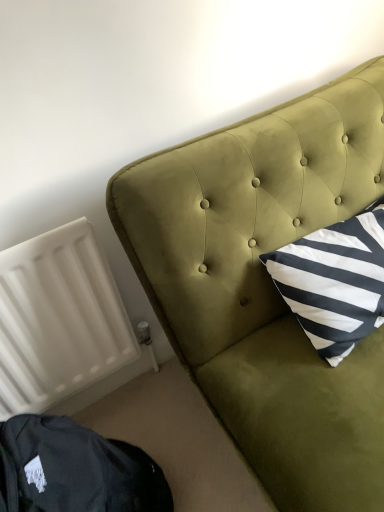
Measure the distance between dark green velvet bean bag chair at lower left and camera.

29.19 inches.

What are the coordinates of `velvet green headboard at upper right` in the screenshot? It's located at (267, 284).

Does velvet green headboard at upper right have a greater height compared to dark green velvet bean bag chair at lower left?

Yes, velvet green headboard at upper right is taller than dark green velvet bean bag chair at lower left.

Based on the photo, is velvet green headboard at upper right far from dark green velvet bean bag chair at lower left?

No.

Considering the relative sizes of velvet green headboard at upper right and dark green velvet bean bag chair at lower left in the image provided, is velvet green headboard at upper right thinner than dark green velvet bean bag chair at lower left?

Incorrect, the width of velvet green headboard at upper right is not less than that of dark green velvet bean bag chair at lower left.

Is velvet green headboard at upper right positioned with its back to dark green velvet bean bag chair at lower left?

velvet green headboard at upper right does not have its back to dark green velvet bean bag chair at lower left.

Considering the relative sizes of dark green velvet bean bag chair at lower left and white matte radiator at lower left in the image provided, is dark green velvet bean bag chair at lower left taller than white matte radiator at lower left?

No.

Between dark green velvet bean bag chair at lower left and white matte radiator at lower left, which one appears on the right side from the viewer's perspective?

dark green velvet bean bag chair at lower left is more to the right.

How many degrees apart are the facing directions of dark green velvet bean bag chair at lower left and white matte radiator at lower left?

The facing directions of dark green velvet bean bag chair at lower left and white matte radiator at lower left are 69.5 degrees apart.

In the image, is dark green velvet bean bag chair at lower left positioned in front of or behind velvet green headboard at upper right?

Visually, dark green velvet bean bag chair at lower left is located behind velvet green headboard at upper right.

Looking at this image, from the image's perspective, is dark green velvet bean bag chair at lower left positioned above or below velvet green headboard at upper right?

dark green velvet bean bag chair at lower left is below velvet green headboard at upper right.

Can you see dark green velvet bean bag chair at lower left touching velvet green headboard at upper right?

No, dark green velvet bean bag chair at lower left is not next to velvet green headboard at upper right.

Does point (74, 392) come in front of point (235, 270)?

No, (74, 392) is further to viewer.

From the image's perspective, is white matte radiator at lower left over velvet green headboard at upper right?

No, from the image's perspective, white matte radiator at lower left is not on top of velvet green headboard at upper right.

Which of these two, white matte radiator at lower left or velvet green headboard at upper right, is wider?

Wider between the two is velvet green headboard at upper right.

Which object is further away from the camera taking this photo, white matte radiator at lower left or velvet green headboard at upper right?

white matte radiator at lower left.

Can you confirm if white matte radiator at lower left is wider than dark green velvet bean bag chair at lower left?

No, white matte radiator at lower left is not wider than dark green velvet bean bag chair at lower left.

Is white matte radiator at lower left in contact with dark green velvet bean bag chair at lower left?

There is a gap between white matte radiator at lower left and dark green velvet bean bag chair at lower left.

Which point is more distant from viewer, (29, 411) or (116, 486)?

The point (29, 411) is more distant.

Measure the distance between white matte radiator at lower left and dark green velvet bean bag chair at lower left.

The distance of white matte radiator at lower left from dark green velvet bean bag chair at lower left is 10.85 inches.

Looking at this image, which object is wider, velvet green headboard at upper right or white matte radiator at lower left?

With larger width is velvet green headboard at upper right.

From the image's perspective, is velvet green headboard at upper right beneath white matte radiator at lower left?

No, from the image's perspective, velvet green headboard at upper right is not beneath white matte radiator at lower left.

Is point (336, 108) positioned behind point (81, 355)?

No.

Does velvet green headboard at upper right lie behind white matte radiator at lower left?

No, velvet green headboard at upper right is closer to the camera.

Locate an element on the screen. furniture on the right of dark green velvet bean bag chair at lower left is located at coordinates (267, 284).

Locate an element on the screen. bean bag chair that appears in front of the white matte radiator at lower left is located at coordinates (75, 470).

Estimate the real-world distances between objects in this image. Which object is closer to dark green velvet bean bag chair at lower left, velvet green headboard at upper right or white matte radiator at lower left?

white matte radiator at lower left.

Which object lies further to the anchor point white matte radiator at lower left, velvet green headboard at upper right or dark green velvet bean bag chair at lower left?

velvet green headboard at upper right lies further to white matte radiator at lower left than the other object.

Based on the photo, looking at the image, which one is located further to velvet green headboard at upper right, dark green velvet bean bag chair at lower left or white matte radiator at lower left?

dark green velvet bean bag chair at lower left lies further to velvet green headboard at upper right than the other object.

Considering their positions, is white matte radiator at lower left positioned closer to velvet green headboard at upper right than dark green velvet bean bag chair at lower left?

white matte radiator at lower left is closer to velvet green headboard at upper right.

Considering their positions, is white matte radiator at lower left positioned closer to dark green velvet bean bag chair at lower left than velvet green headboard at upper right?

white matte radiator at lower left is positioned closer to the anchor dark green velvet bean bag chair at lower left.

From the image, which object appears to be nearer to white matte radiator at lower left, dark green velvet bean bag chair at lower left or velvet green headboard at upper right?

Based on the image, dark green velvet bean bag chair at lower left appears to be nearer to white matte radiator at lower left.

The image size is (384, 512). In order to click on bean bag chair located between white matte radiator at lower left and velvet green headboard at upper right in the left-right direction in this screenshot , I will do `click(75, 470)`.